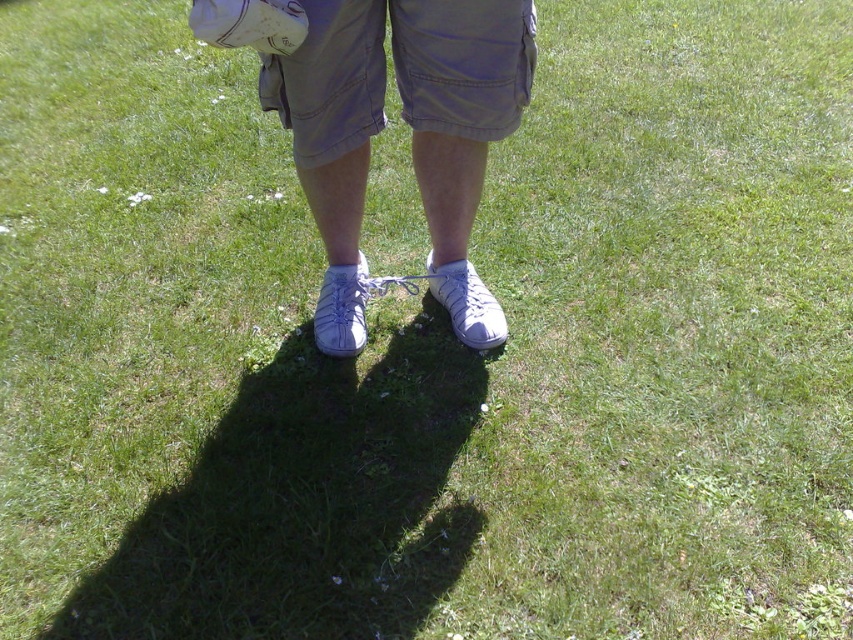
Who is lower down, white leather sneakers at center or khaki cotton shorts at center?

white leather sneakers at center is lower down.

Looking at this image, is white leather sneakers at center wider than khaki cotton shorts at center?

Yes.

Between point (300, 161) and point (265, 92), which one is positioned behind?

Point (300, 161)

The width and height of the screenshot is (853, 640). I want to click on white leather sneakers at center, so click(x=383, y=125).